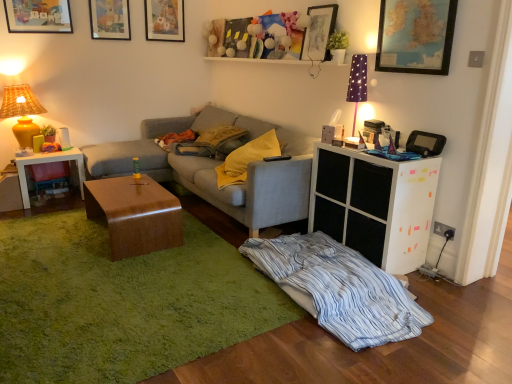
Identify the location of vacant space situated above glossy wood coffee table at center (from a real-world perspective). (129, 185).